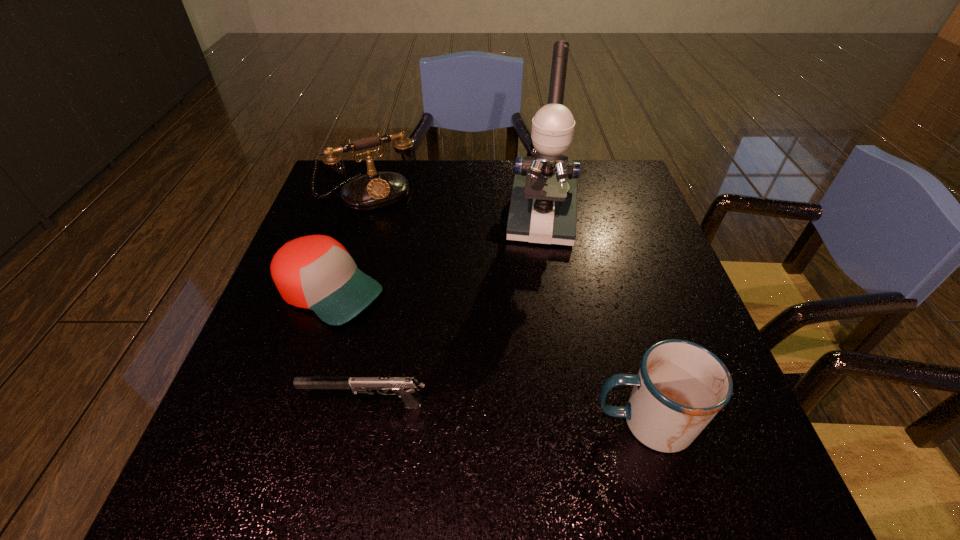
You are a GUI agent. You are given a task and a screenshot of the screen. Output one action in this format:
    pyautogui.click(x=<x>, y=<y>)
    Task: Click on the free spot on the desktop that is between the gun and the third tallest object and is positioned at the brim of the second shortest object
    The height and width of the screenshot is (540, 960).
    Given the screenshot: What is the action you would take?
    pyautogui.click(x=541, y=416)

This screenshot has height=540, width=960. I want to click on free space on the desktop that is between the gun and the third shortest object and is positioned on the dial of the telephone, so click(x=500, y=413).

I want to click on free space on the desktop that is between the gun and the third shortest object and is positioned at the eyepiece of the microscope, so click(526, 415).